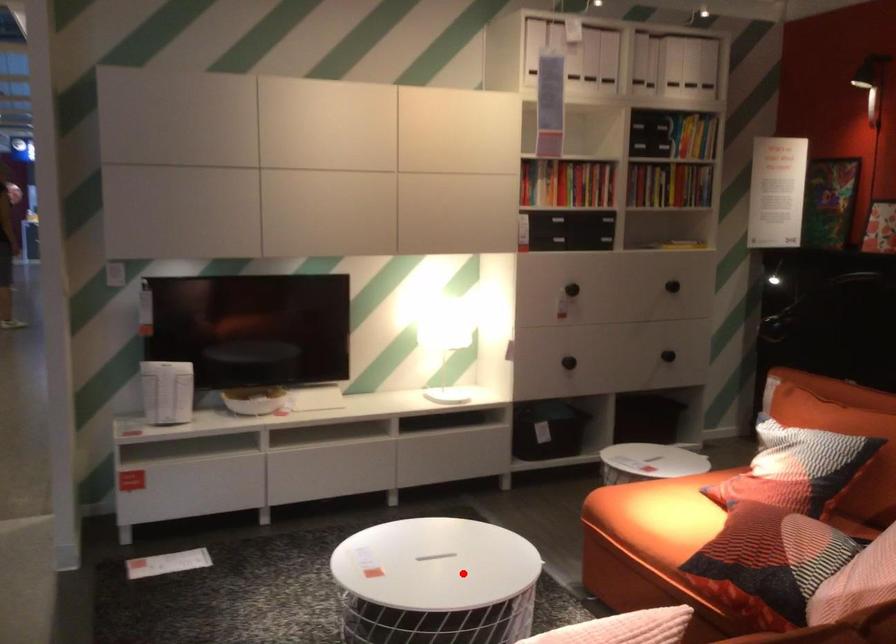
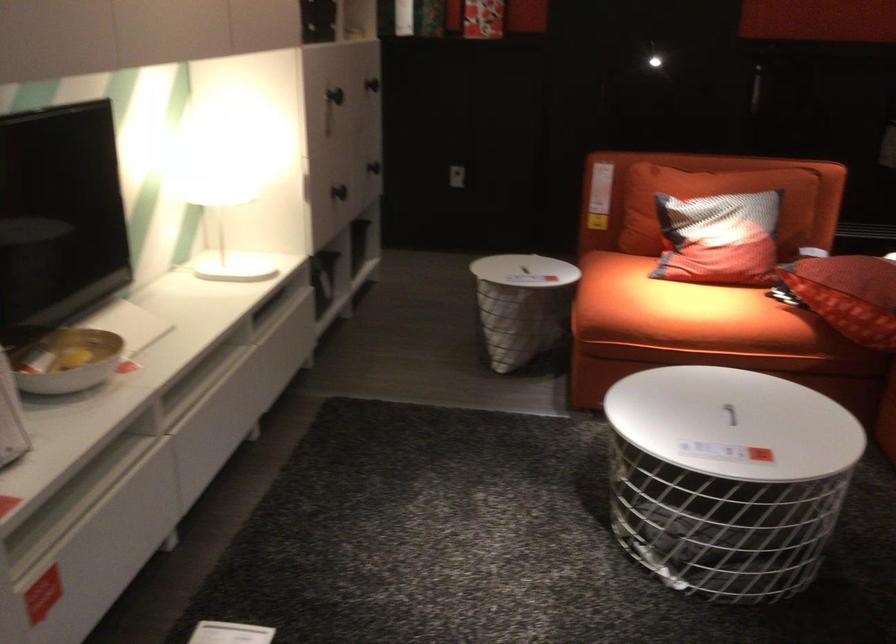
Question: I am providing you with two images of the same scene from different viewpoints. A red point is shown in image1. For the corresponding object point in image2, is it positioned nearer or farther from the camera?

Choices:
 (A) Nearer
 (B) Farther

Answer: (A)